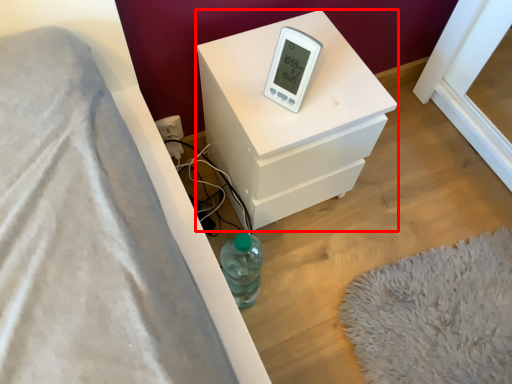
Question: From the image, what is the correct spatial relationship of nightstand (annotated by the red box) in relation to thermometer?

Choices:
 (A) left
 (B) right

Answer: (B)